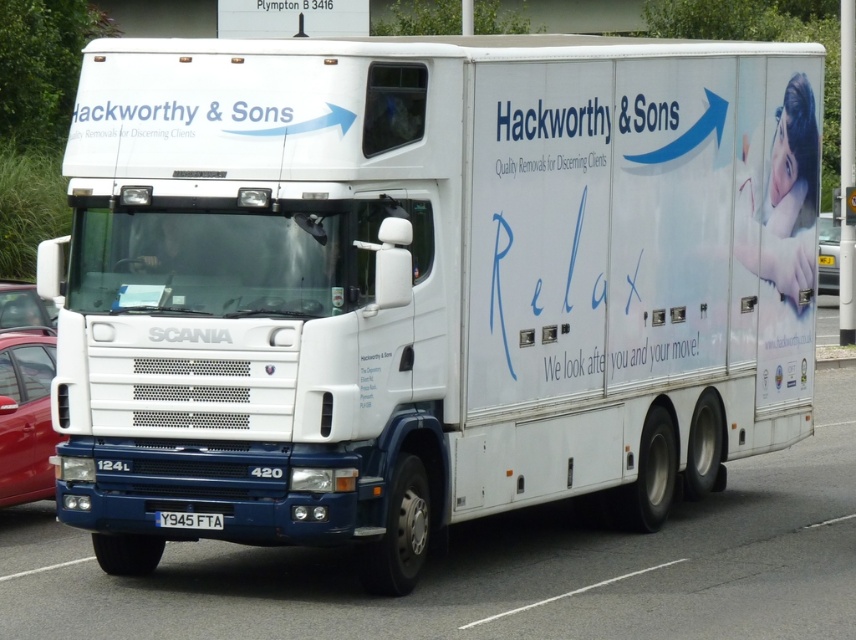
You are standing at the camera position and want to reach the point marked as point (835,243). The maximum distance you can walk is 100 feet. Can you reach it without exceeding your walking limit?

The distance between point (835,243) and the camera is 117.84 feet, which exceeds your maximum walking distance of 100 feet. Therefore, you cannot reach it without exceeding your limit.

You are standing at the center of the image and want to walk to the metallic silver car at right. In which direction should you move?

Since the metallic silver car at right is located at the right side of the image, you should move towards the right direction to reach it.

You are a driver who needs to park your car behind the white plastic license plate at center. However, there is a metallic red car at left in the way. Can you drive around it to park behind the license plate?

The metallic red car at left is larger in size than the white plastic license plate at center. Since the license plate is smaller, it might be blocked by the car, making it difficult to park behind it. You should consider an alternative parking spot.